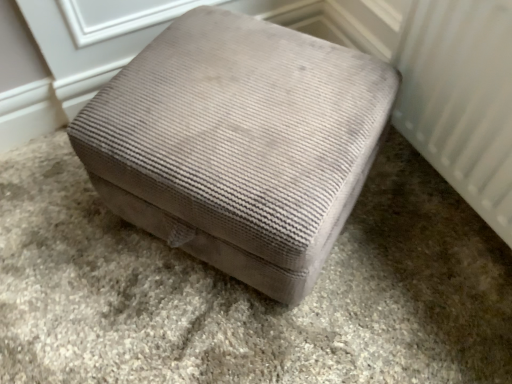
The image size is (512, 384). In order to click on white textured radiator at right in this screenshot , I will do tap(461, 99).

Image resolution: width=512 pixels, height=384 pixels. In order to click on velvet ottoman at center in this screenshot , I will do `click(248, 290)`.

Based on the photo, measure the distance between point (184, 271) and camera.

Point (184, 271) is 3.82 feet from camera.

In order to face velvet ottoman at center, should I rotate leftwards or rightwards?

You should rotate left by 2.533 degrees.

Find the location of `white textured radiator at right`. white textured radiator at right is located at coordinates (461, 99).

Is white textured radiator at right at the back of velvet ottoman at center?

No, velvet ottoman at center's orientation is not away from white textured radiator at right.

From the picture: From the image's perspective, would you say velvet ottoman at center is positioned over white textured radiator at right?

Incorrect, from the image's perspective, velvet ottoman at center is lower than white textured radiator at right.

Is point (328, 370) closer to viewer compared to point (435, 94)?

Yes, point (328, 370) is in front of point (435, 94).

Is velvet ottoman at center thinner than white textured radiator at right?

No, velvet ottoman at center is not thinner than white textured radiator at right.

Can you see velvet ottoman at center touching beige textured ottoman at center?

They are not placed beside each other.

Which is more to the right, velvet ottoman at center or beige textured ottoman at center?

Positioned to the right is velvet ottoman at center.

Is velvet ottoman at center oriented away from beige textured ottoman at center?

No, beige textured ottoman at center is not at the back of velvet ottoman at center.

From the image's perspective, is velvet ottoman at center located beneath beige textured ottoman at center?

Yes, from the image's perspective, velvet ottoman at center is beneath beige textured ottoman at center.

Is white textured radiator at right located outside beige textured ottoman at center?

That's correct, white textured radiator at right is outside of beige textured ottoman at center.

Between white textured radiator at right and beige textured ottoman at center, which one has less height?

beige textured ottoman at center is shorter.

Can you confirm if white textured radiator at right is thinner than beige textured ottoman at center?

No.

Where is `radiator above the velvet ottoman at center (from the image's perspective)`? This screenshot has height=384, width=512. radiator above the velvet ottoman at center (from the image's perspective) is located at coordinates (461, 99).

Would you say velvet ottoman at center is outside white textured radiator at right?

Absolutely, velvet ottoman at center is external to white textured radiator at right.

From the image's perspective, relative to white textured radiator at right, is velvet ottoman at center above or below?

From the image's perspective, velvet ottoman at center appears below white textured radiator at right.

Considering the sizes of objects velvet ottoman at center and white textured radiator at right in the image provided, who is bigger, velvet ottoman at center or white textured radiator at right?

With larger size is velvet ottoman at center.

From the picture: Does beige textured ottoman at center have a smaller size compared to velvet ottoman at center?

Correct, beige textured ottoman at center occupies less space than velvet ottoman at center.

Considering the sizes of objects beige textured ottoman at center and velvet ottoman at center in the image provided, who is shorter, beige textured ottoman at center or velvet ottoman at center?

Standing shorter between the two is velvet ottoman at center.

Which object is thinner, beige textured ottoman at center or velvet ottoman at center?

With smaller width is beige textured ottoman at center.

How different are the orientations of beige textured ottoman at center and velvet ottoman at center in degrees?

55.3 degrees separate the facing orientations of beige textured ottoman at center and velvet ottoman at center.

Which is in front, beige textured ottoman at center or white textured radiator at right?

white textured radiator at right is in front.

Which of these two, beige textured ottoman at center or white textured radiator at right, is smaller?

beige textured ottoman at center is smaller.

From a real-world perspective, is beige textured ottoman at center over white textured radiator at right?

No, from a real-world perspective, beige textured ottoman at center is not above white textured radiator at right.

Is beige textured ottoman at center aimed at white textured radiator at right?

Yes, beige textured ottoman at center faces towards white textured radiator at right.

Considering the sizes of beige textured ottoman at center and velvet ottoman at center in the image, is beige textured ottoman at center bigger or smaller than velvet ottoman at center?

Clearly, beige textured ottoman at center is smaller in size than velvet ottoman at center.

Can you tell me how much beige textured ottoman at center and velvet ottoman at center differ in facing direction?

beige textured ottoman at center and velvet ottoman at center are facing 0.206 degrees away from each other.

From the image's perspective, who appears lower, beige textured ottoman at center or velvet ottoman at center?

velvet ottoman at center.

Is beige textured ottoman at center far away from velvet ottoman at center?

beige textured ottoman at center is actually quite close to velvet ottoman at center.

I want to click on radiator on the right side of velvet ottoman at center, so click(461, 99).

Image resolution: width=512 pixels, height=384 pixels. In order to click on screen door behind the velvet ottoman at center in this screenshot , I will do `click(113, 36)`.

From the image, which object appears to be farther from velvet ottoman at center, white textured radiator at right or velvet ottoman at center?

The object further to velvet ottoman at center is white textured radiator at right.

Estimate the real-world distances between objects in this image. Which object is closer to velvet ottoman at center, white textured radiator at right or beige textured ottoman at center?

white textured radiator at right is closer to velvet ottoman at center.

Which object lies nearer to the anchor point white textured radiator at right, velvet ottoman at center or velvet ottoman at center?

velvet ottoman at center is positioned closer to the anchor white textured radiator at right.

Which object lies further to the anchor point beige textured ottoman at center, velvet ottoman at center or velvet ottoman at center?

velvet ottoman at center.

Estimate the real-world distances between objects in this image. Which object is further from beige textured ottoman at center, velvet ottoman at center or white textured radiator at right?

white textured radiator at right.

Looking at this image, looking at the image, which one is located closer to white textured radiator at right, beige textured ottoman at center or velvet ottoman at center?

velvet ottoman at center is positioned closer to the anchor white textured radiator at right.

Which object lies further to the anchor point velvet ottoman at center, beige textured ottoman at center or white textured radiator at right?

beige textured ottoman at center is further to velvet ottoman at center.

From the image, which object appears to be farther from velvet ottoman at center, beige textured ottoman at center or velvet ottoman at center?

beige textured ottoman at center is positioned further to the anchor velvet ottoman at center.

I want to click on furniture between beige textured ottoman at center and velvet ottoman at center vertically, so click(x=239, y=144).

Locate an element on the screen. concrete between beige textured ottoman at center and white textured radiator at right in the horizontal direction is located at coordinates (248, 290).

Identify the location of furniture situated between beige textured ottoman at center and white textured radiator at right from left to right. The image size is (512, 384). (239, 144).

Image resolution: width=512 pixels, height=384 pixels. I want to click on furniture between velvet ottoman at center and white textured radiator at right, so click(x=239, y=144).